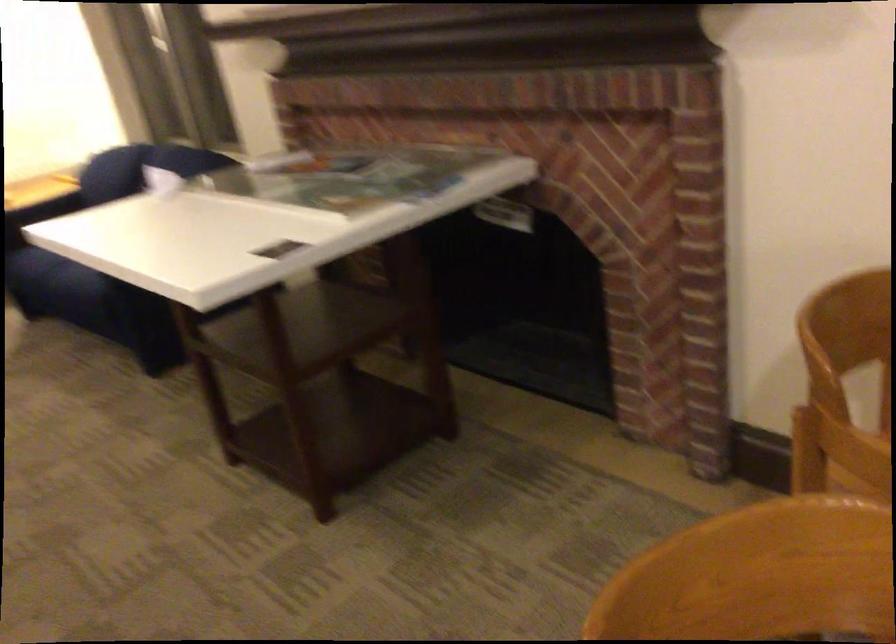
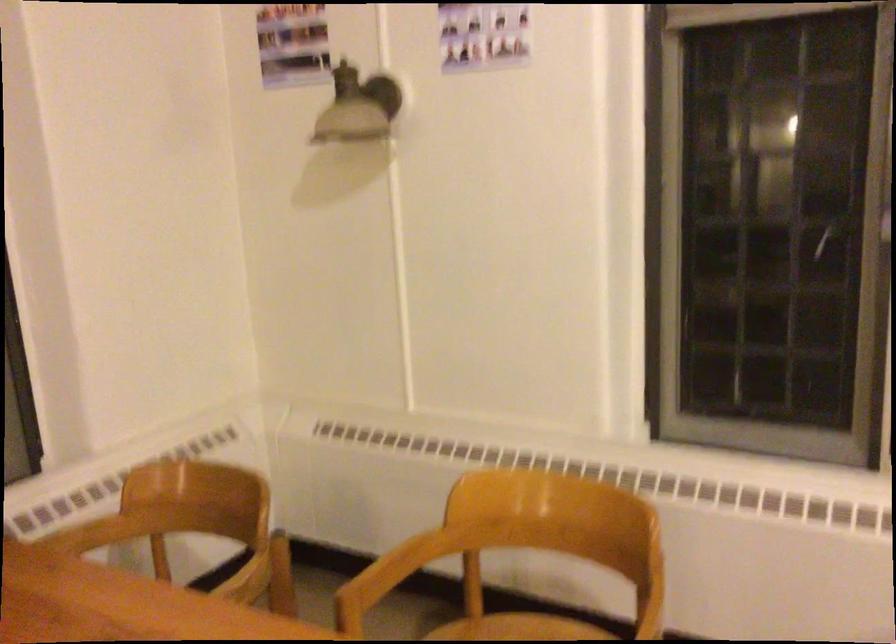
Question: Based on the continuous images, in which direction is the camera rotating? Reply with the corresponding letter.

Choices:
 (A) Left
 (B) Right
 (C) Up
 (D) Down

Answer: (B)